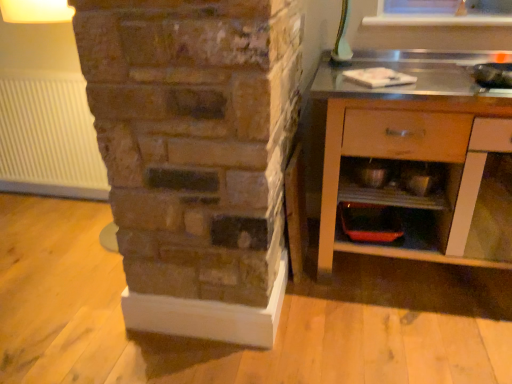
Question: Can you confirm if metallic silver bowls at lower right, placed as the 1th shelf when sorted from top to bottom, is smaller than white ribbed radiator at left?

Choices:
 (A) yes
 (B) no

Answer: (A)

Question: Can you confirm if metallic silver bowls at lower right, placed as the 1th shelf when sorted from top to bottom, is wider than white ribbed radiator at left?

Choices:
 (A) yes
 (B) no

Answer: (A)

Question: Can you confirm if metallic silver bowls at lower right, placed as the 1th shelf when sorted from top to bottom, is shorter than white ribbed radiator at left?

Choices:
 (A) yes
 (B) no

Answer: (A)

Question: From a real-world perspective, is metallic silver bowls at lower right, placed as the 1th shelf when sorted from top to bottom, on white ribbed radiator at left?

Choices:
 (A) no
 (B) yes

Answer: (B)

Question: Is metallic silver bowls at lower right, the second shelf in the bottom-to-top sequence, looking in the opposite direction of white ribbed radiator at left?

Choices:
 (A) no
 (B) yes

Answer: (A)

Question: Would you say metallic silver bowls at lower right, placed as the 1th shelf when sorted from top to bottom, is to the left or to the right of wooden cabinet at right in the picture?

Choices:
 (A) left
 (B) right

Answer: (A)

Question: From a real-world perspective, is metallic silver bowls at lower right, the second shelf in the bottom-to-top sequence, positioned above or below wooden cabinet at right?

Choices:
 (A) below
 (B) above

Answer: (B)

Question: Considering the positions of metallic silver bowls at lower right, placed as the 1th shelf when sorted from top to bottom, and wooden cabinet at right in the image, is metallic silver bowls at lower right, placed as the 1th shelf when sorted from top to bottom, bigger or smaller than wooden cabinet at right?

Choices:
 (A) small
 (B) big

Answer: (A)

Question: From the image's perspective, relative to wooden cabinet at right, is metallic silver bowls at lower right, the second shelf in the bottom-to-top sequence, above or below?

Choices:
 (A) above
 (B) below

Answer: (B)

Question: From a real-world perspective, is white ribbed radiator at left physically located above or below matte orange tray at lower center, the 1th shelf ordered from the bottom?

Choices:
 (A) above
 (B) below

Answer: (A)

Question: Relative to matte orange tray at lower center, the 1th shelf ordered from the bottom, is white ribbed radiator at left in front or behind?

Choices:
 (A) front
 (B) behind

Answer: (B)

Question: Is white ribbed radiator at left inside the boundaries of matte orange tray at lower center, the 1th shelf ordered from the bottom, or outside?

Choices:
 (A) inside
 (B) outside

Answer: (B)

Question: Is white ribbed radiator at left to the left or to the right of matte orange tray at lower center, the 2th shelf positioned from the top, in the image?

Choices:
 (A) left
 (B) right

Answer: (A)

Question: From a real-world perspective, relative to white ribbed radiator at left, is matte orange tray at lower center, the 2th shelf positioned from the top, vertically above or below?

Choices:
 (A) below
 (B) above

Answer: (A)

Question: Relative to white ribbed radiator at left, is matte orange tray at lower center, the 2th shelf positioned from the top, in front or behind?

Choices:
 (A) front
 (B) behind

Answer: (A)